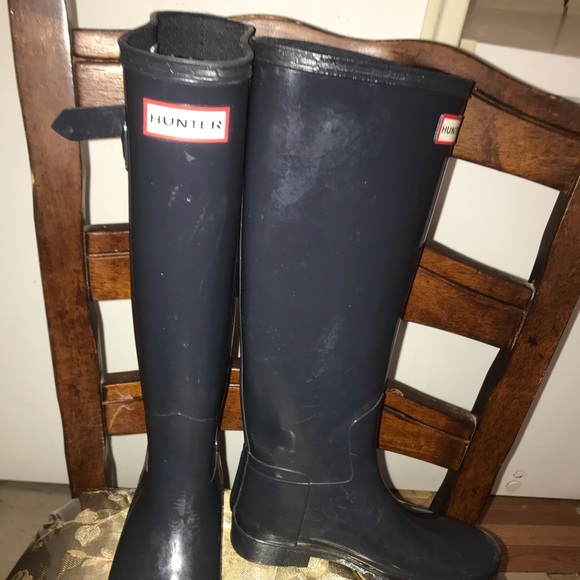
The image size is (580, 580). In order to click on electrical outlet in this screenshot , I will do `click(517, 487)`.